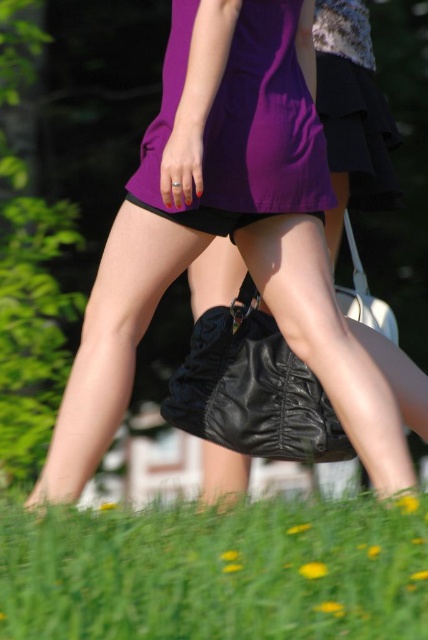
You are a photographer trying to capture a clear shot of the green grass at lower center and the purple satin dress at center. Since the dress is covering part of the grass, can you adjust your camera angle to focus on the grass without moving the subjects?

The green grass at lower center is positioned under the purple satin dress at center, so you can lower your camera angle to capture the grass visible beneath the dress.

You are standing at point (238,108) and want to walk to point (332,579). Is the path between these two points clear of any obstacles?

Yes, the path between point (332,579) and point (238,108) is clear because point (332,579) is in front of point (238,108), indicating no obstruction between them.

Looking at this image, you are a photographer setting up a camera on a tripod. You want to capture both the green grass at lower center and the purple satin dress at center in the same frame. The camera has a fixed focal length and a field of view that can cover a maximum distance of 5 feet between the nearest and farthest objects. Will you be able to include both in the frame?

The distance between the green grass at lower center and the purple satin dress at center is 5.02 feet. Since the camera can only cover up to 5 feet, the 5.02 feet distance exceeds the maximum coverage. Therefore, both objects cannot be included in the same frame.